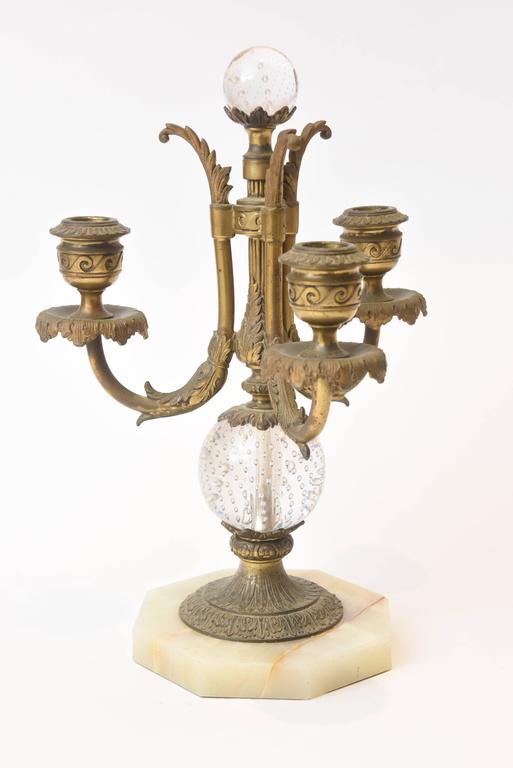
The width and height of the screenshot is (513, 768). I want to click on clear glass globe, so (x=268, y=61).